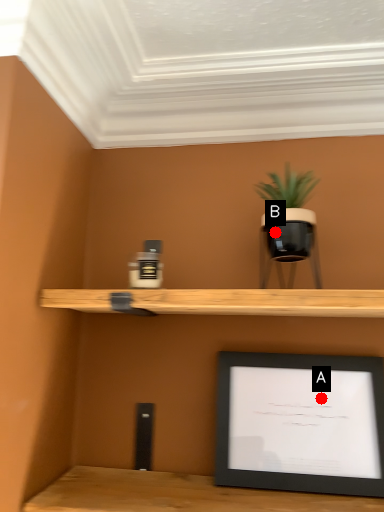
Question: Two points are circled on the image, labeled by A and B beside each circle. Which point appears closest to the camera in this image?

Choices:
 (A) A is closer
 (B) B is closer

Answer: (B)